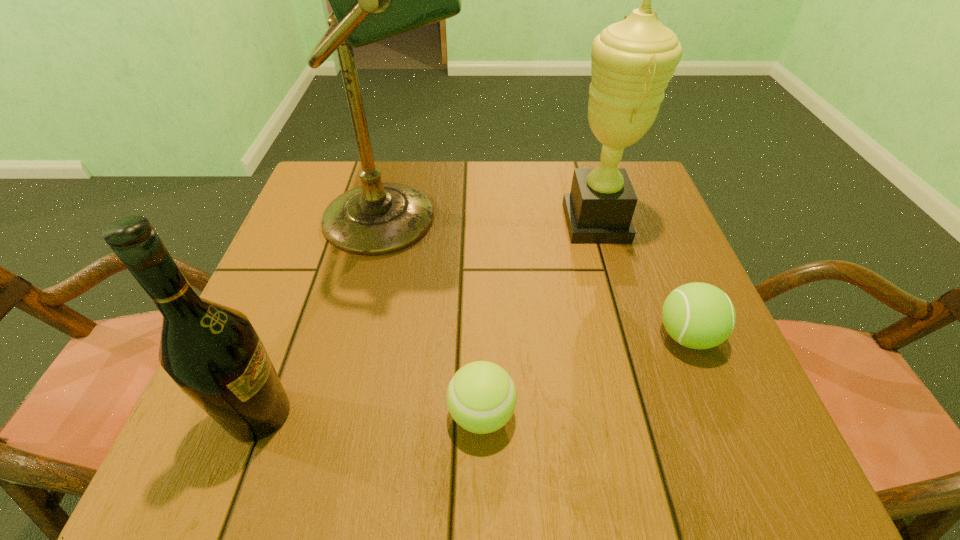
The width and height of the screenshot is (960, 540). I want to click on table lamp, so click(x=372, y=0).

The width and height of the screenshot is (960, 540). Find the location of `trophy cup`. trophy cup is located at coordinates (633, 60).

This screenshot has width=960, height=540. What are the coordinates of `wine bottle` in the screenshot? It's located at (212, 352).

Identify the location of the third farthest object. (697, 315).

You are a GUI agent. You are given a task and a screenshot of the screen. Output one action in this format:
    pyautogui.click(x=<x>, y=<y>)
    Task: Click on the farther tennis ball
    
    Given the screenshot: What is the action you would take?
    pyautogui.click(x=697, y=315)

Image resolution: width=960 pixels, height=540 pixels. What are the coordinates of `the nearer tennis ball` in the screenshot? It's located at (481, 397).

Where is `free spot located 0.210m above the green lampshade of the table lamp`? The width and height of the screenshot is (960, 540). free spot located 0.210m above the green lampshade of the table lamp is located at coordinates (560, 218).

Image resolution: width=960 pixels, height=540 pixels. I want to click on free region located at the front of the trophy cup with handles, so click(x=398, y=222).

Find the location of a particular element. free location located at the front of the trophy cup with handles is located at coordinates (402, 222).

Where is `free space located at the front of the trophy cup with handles`? free space located at the front of the trophy cup with handles is located at coordinates (446, 222).